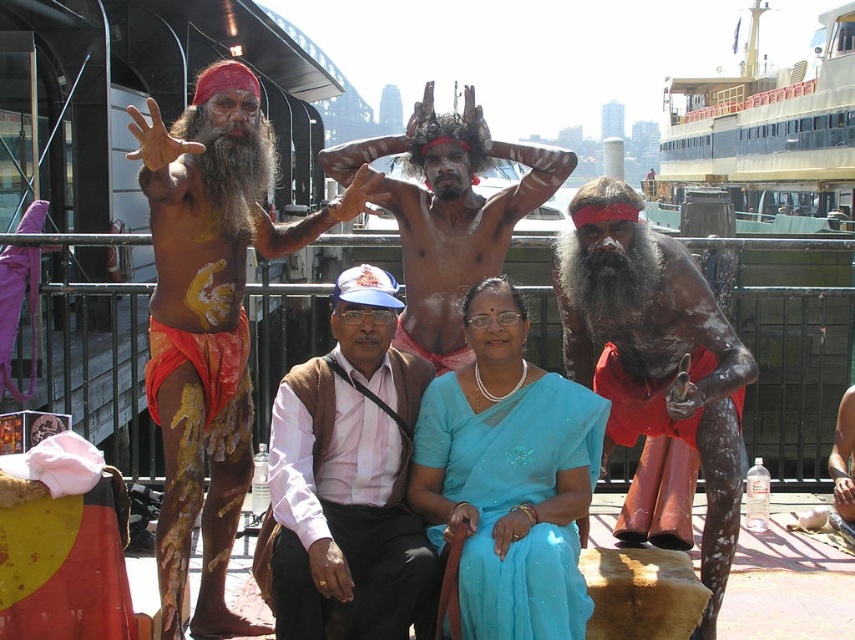
Question: Which object appears closest to the camera in this image?

Choices:
 (A) matte skin man at center
 (B) blue silk saree at center
 (C) matte black body paint at center

Answer: (B)

Question: Can you confirm if matte black body paint at center is thinner than matte skin man at center?

Choices:
 (A) no
 (B) yes

Answer: (B)

Question: Does matte red shorts at left appear over matte skin man at center?

Choices:
 (A) yes
 (B) no

Answer: (B)

Question: Does matte red shorts at left have a larger size compared to light pink fabric at center?

Choices:
 (A) yes
 (B) no

Answer: (A)

Question: Among these points, which one is nearest to the camera?

Choices:
 (A) (213, 380)
 (B) (289, 392)
 (C) (814, 125)

Answer: (B)

Question: Which object appears farthest from the camera in this image?

Choices:
 (A) matte skin man at center
 (B) matte black body paint at center
 (C) light pink fabric at center

Answer: (A)